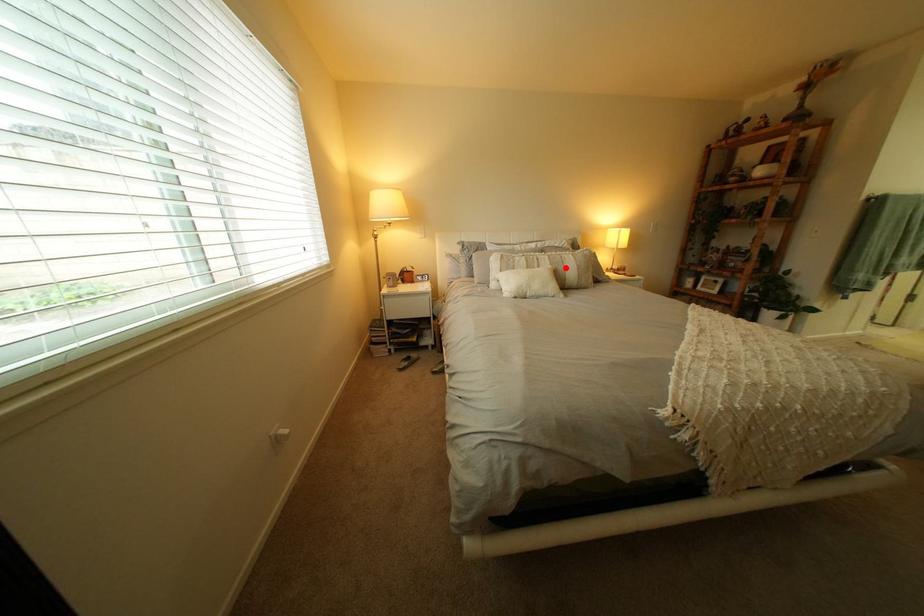
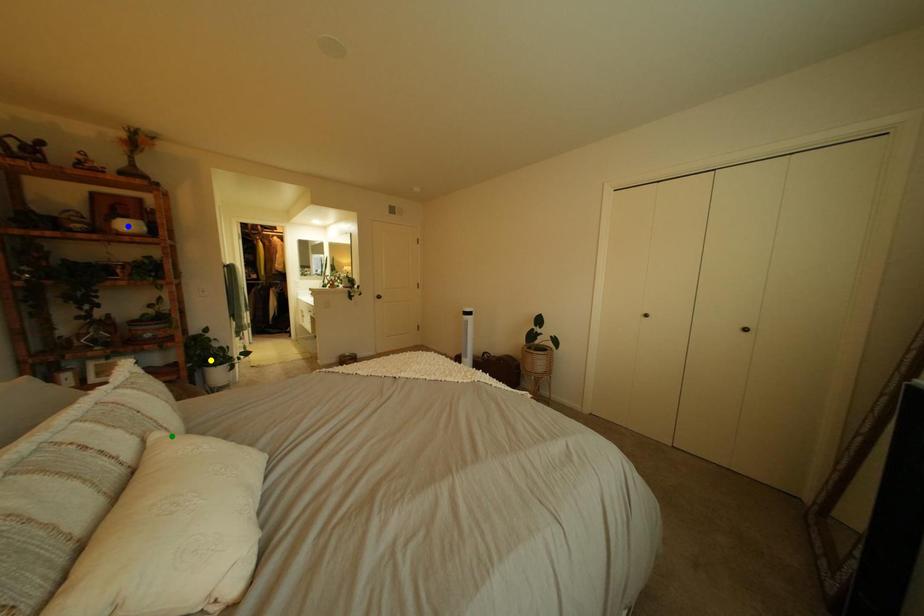
Question: I am providing you with two images of the same scene from different viewpoints. A red point is marked on the first image. You are given multiple points on the second image. Which spot in image 2 lines up with the point in image 1?

Choices:
 (A) blue point
 (B) yellow point
 (C) green point

Answer: (C)